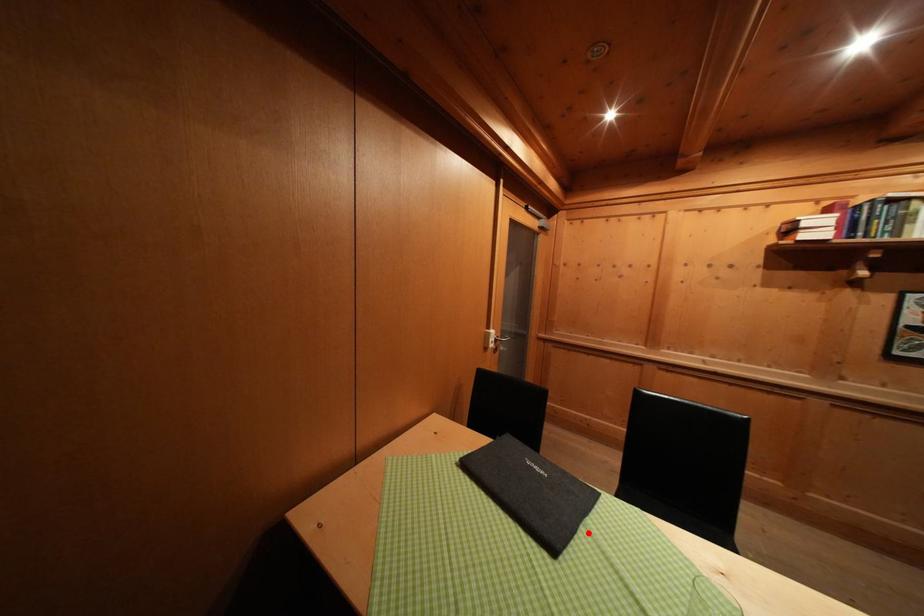
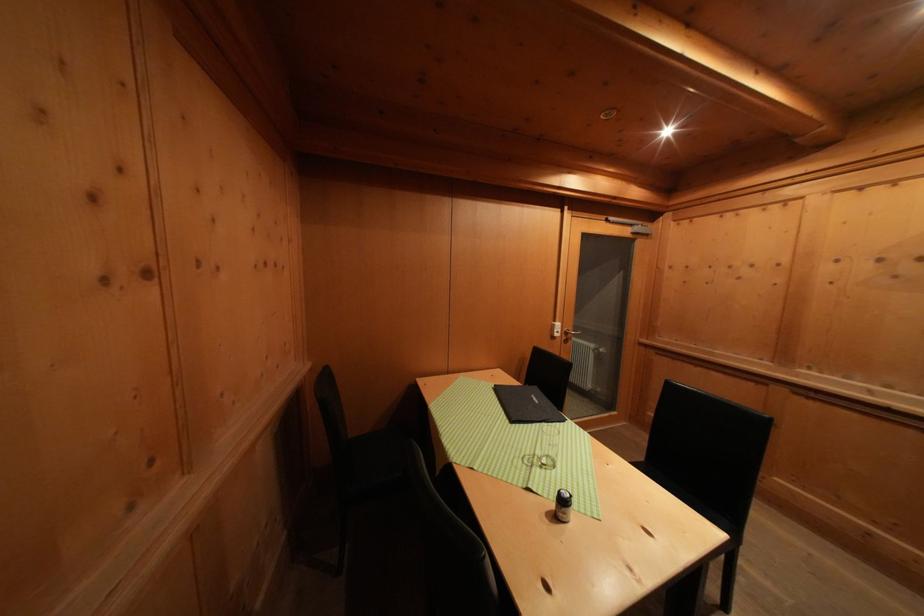
In the second image, find the point that corresponds to the highlighted location in the first image.

(543, 429)